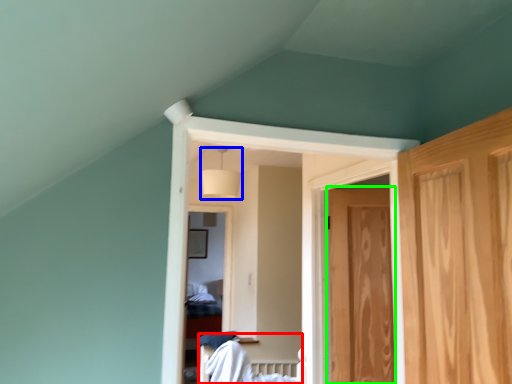
Question: Which object is the closest to the bed (highlighted by a red box)? Choose among these: lamp (highlighted by a blue box) or door (highlighted by a green box).

Choices:
 (A) lamp
 (B) door

Answer: (B)